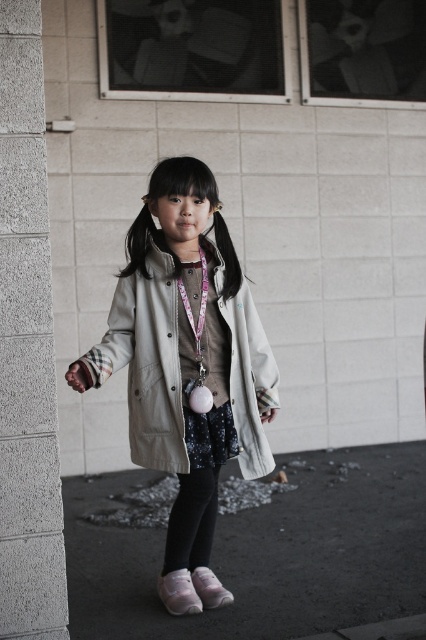
Does black asphalt at lower center appear on the right side of matte beige coat at center?

Indeed, black asphalt at lower center is positioned on the right side of matte beige coat at center.

Based on the photo, which is more to the left, black asphalt at lower center or matte beige coat at center?

Positioned to the left is matte beige coat at center.

Locate an element on the screen. The image size is (426, 640). black asphalt at lower center is located at coordinates (262, 552).

Identify the location of black asphalt at lower center. The width and height of the screenshot is (426, 640). (262, 552).

Which of these two, pink fabric lanyard at center or white fabric shoe at lower center, stands shorter?

With less height is white fabric shoe at lower center.

Is pink fabric lanyard at center positioned behind white fabric shoe at lower center?

No, pink fabric lanyard at center is closer to the viewer.

Locate an element on the screen. The height and width of the screenshot is (640, 426). pink fabric lanyard at center is located at coordinates (196, 342).

Can you confirm if pink fabric lanyard at center is smaller than white suede shoe at lower center?

No.

Describe the element at coordinates (196, 342) in the screenshot. I see `pink fabric lanyard at center` at that location.

Identify the location of pink fabric lanyard at center. Image resolution: width=426 pixels, height=640 pixels. (196, 342).